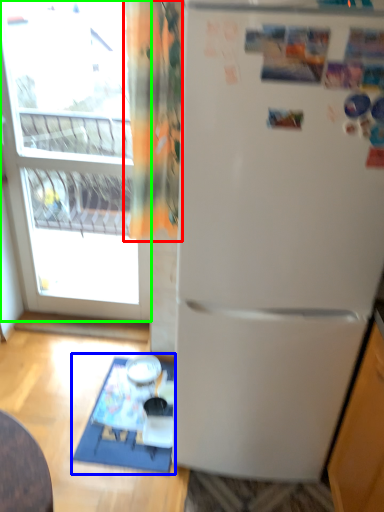
Question: Considering the real-world distances, which object is farthest from curtain (highlighted by a red box)? table (highlighted by a blue box) or window (highlighted by a green box)?

Choices:
 (A) table
 (B) window

Answer: (B)